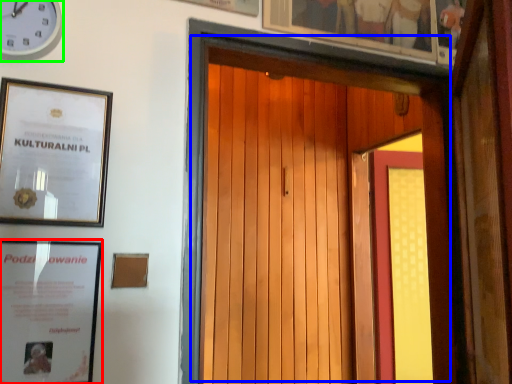
Question: Estimate the real-world distances between objects in this image. Which object is closer to picture frame (highlighted by a red box), door (highlighted by a blue box) or clock (highlighted by a green box)?

Choices:
 (A) door
 (B) clock

Answer: (A)